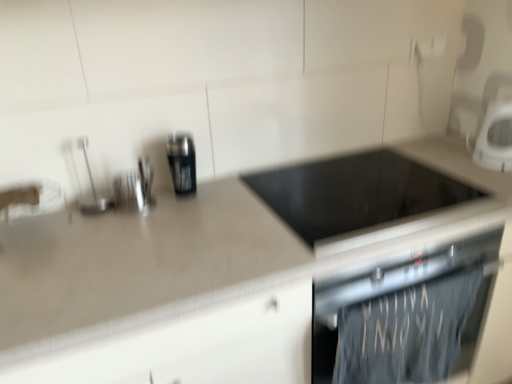
Question: Based on their positions, is white glossy microwave at upper right, placed as the second kitchen appliance when sorted from left to right, located to the left or right of metallic can at center, the 2th kitchen appliance from the right?

Choices:
 (A) left
 (B) right

Answer: (B)

Question: From the image's perspective, is white glossy microwave at upper right, which is the 1th kitchen appliance from right to left, above or below metallic can at center, the 2th kitchen appliance from the right?

Choices:
 (A) below
 (B) above

Answer: (B)

Question: Which object is positioned farthest from the dark gray fabric towel at lower right?

Choices:
 (A) white glossy microwave at upper right, placed as the second kitchen appliance when sorted from left to right
 (B) metallic can at center, arranged as the 1th kitchen appliance when viewed from the left
 (C) brushed metal spoon at upper left, the 3th appliance in the right-to-left sequence
 (D) brushed metal utensil holder at upper left, which appears as the 2th appliance when viewed from the left
 (E) black glass cooktop at center, the first appliance viewed from the right

Answer: (C)

Question: Which is nearer to the dark gray fabric towel at lower right?

Choices:
 (A) white glossy microwave at upper right, which is the 1th kitchen appliance from right to left
 (B) beige laminate countertop at center
 (C) brushed metal utensil holder at upper left, the 2th appliance viewed from the right
 (D) black glass cooktop at center, the first appliance viewed from the right
 (E) brushed metal spoon at upper left, which is the first appliance from left to right

Answer: (B)